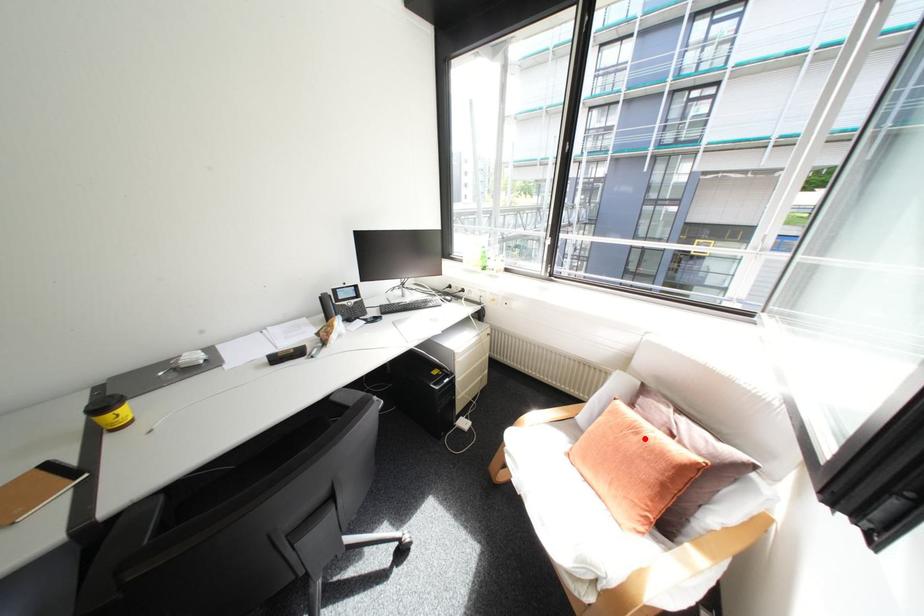
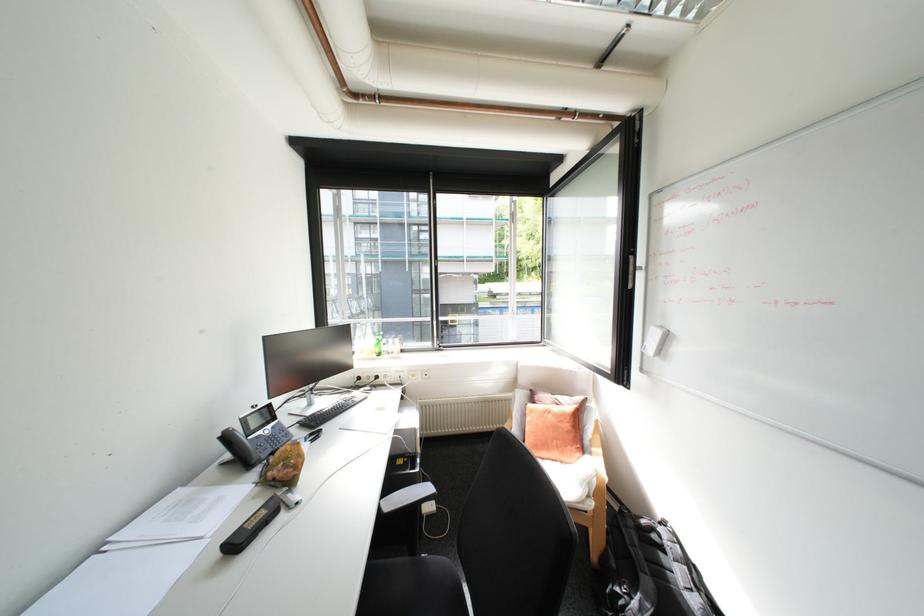
Question: I am providing you with two images of the same scene from different viewpoints. A red point is shown in image1. For the corresponding object point in image2, is it positioned nearer or farther from the camera?

Choices:
 (A) Nearer
 (B) Farther

Answer: (B)